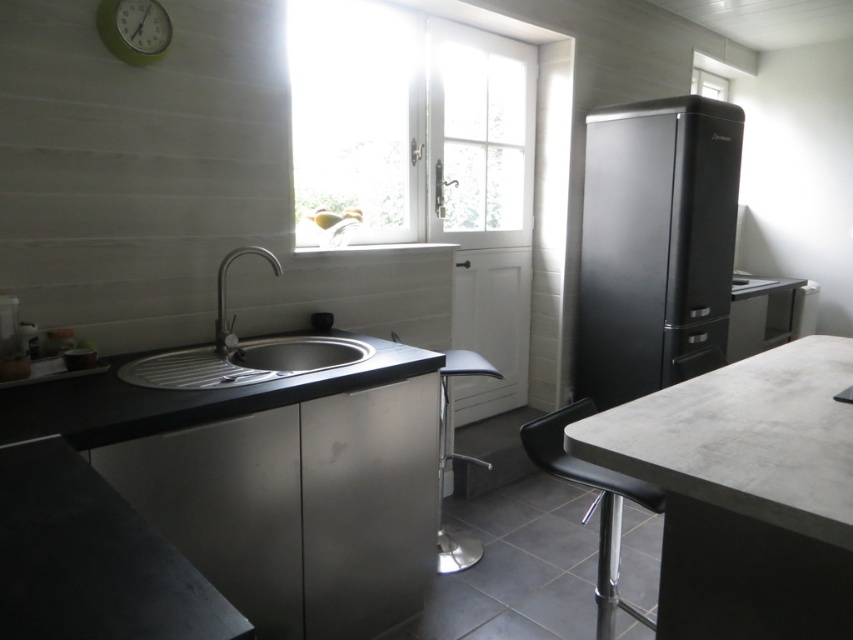
You are organizing the kitchen and need to place a new appliance. The black matte refrigerator at right is above the black matte countertop at lower left. Can you place a tall appliance between them?

The black matte refrigerator at right is located above the black matte countertop at lower left, so there is no space between them for placing a tall appliance.

You are organizing a dinner party and need to place a rectangular cake stand that is 1 meter wide. You have two options to place it on either the black matte refrigerator at right or the black matte countertop at lower left. Which surface can accommodate the cake stand without it overhanging?

The black matte countertop at lower left is wider than the black matte refrigerator at right. Since the cake stand is 1 meter wide, it can be placed on the black matte countertop at lower left as it has sufficient width to accommodate the stand without overhanging.

You are planning to move a new microwave that is the same size as the transparent glass window at upper right into the kitchen. The black matte refrigerator at right is currently occupying the space where you want to place the microwave. Can the microwave be placed in that spot without removing the refrigerator?

The black matte refrigerator at right is larger in size than the transparent glass window at upper right. Since the microwave is the same size as the window, it would be smaller than the refrigerator. However, the refrigerator is already occupying the space, so the microwave cannot be placed there without removing the refrigerator.